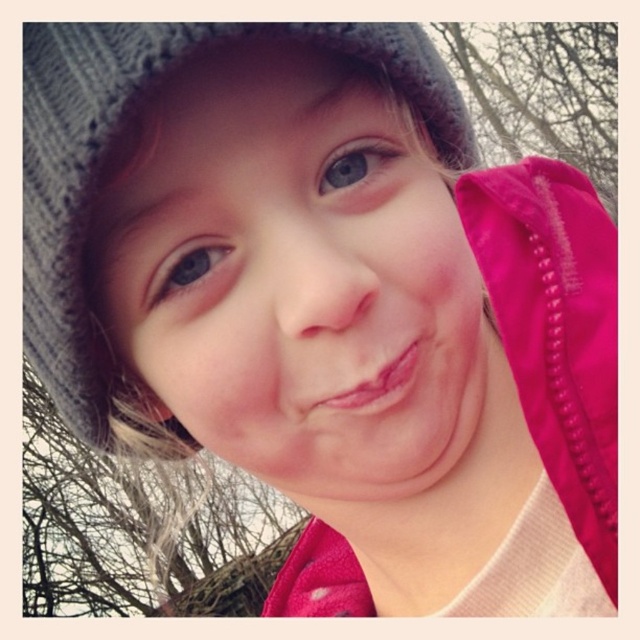
Question: Which of these objects is positioned farthest from the pink glossy lips at center?

Choices:
 (A) blue matte eye at upper center
 (B) matte gray knit hat at center

Answer: (A)

Question: Where is matte gray knit hat at center located in relation to pink glossy lips at center in the image?

Choices:
 (A) right
 (B) left

Answer: (B)

Question: Does matte gray knit hat at center appear under blue matte eye at upper center?

Choices:
 (A) no
 (B) yes

Answer: (B)

Question: Can you confirm if matte gray knit hat at center is smaller than pink glossy lips at center?

Choices:
 (A) no
 (B) yes

Answer: (A)

Question: Which of the following is the farthest from the observer?

Choices:
 (A) blue matte eye at upper center
 (B) blue matte eye at upper left
 (C) pink glossy lips at center
 (D) matte gray knit hat at center

Answer: (A)

Question: Which object is farther from the camera taking this photo?

Choices:
 (A) blue matte eye at upper center
 (B) matte gray knit hat at center

Answer: (A)